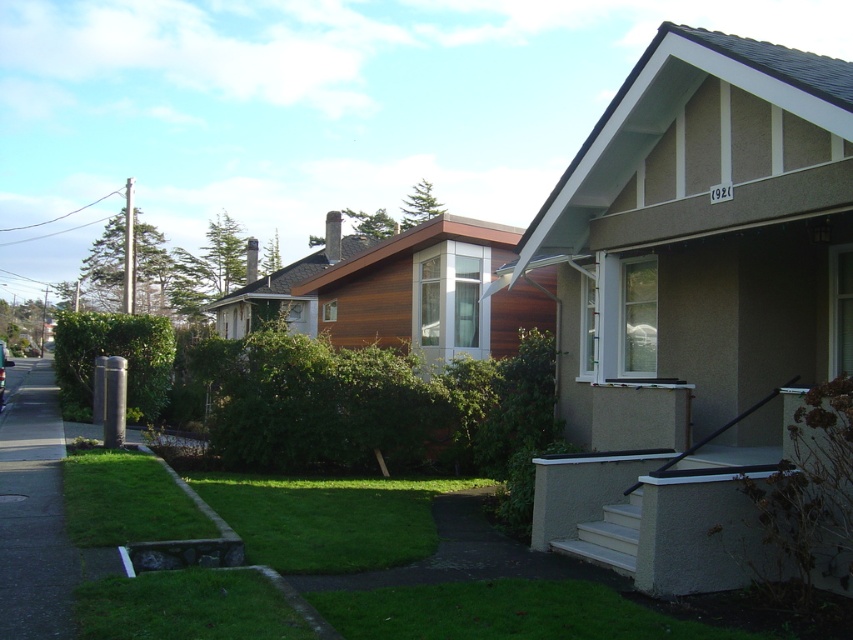
You are a delivery person trying to place a package on the ground in this residential street scene. The package is too heavy to lift high. You can only place it on a surface that is lower than the ground level. Which location between the gray concrete sidewalk at lower left and the green grass at lower center should you choose?

The gray concrete sidewalk at lower left is much taller than the green grass at lower center, so you should place the package on the green grass at lower center since it is lower in height.

Looking at this image, you are a delivery person trying to navigate between two points on the residential street scene. You need to deliver a package to the house on the right with the house number 920. Which point, point (56, 573) or point (235, 608), is closer to the house on the right?

Point (235, 608) is closer to the house on the right because it is in front of point (56, 573), which is behind it.